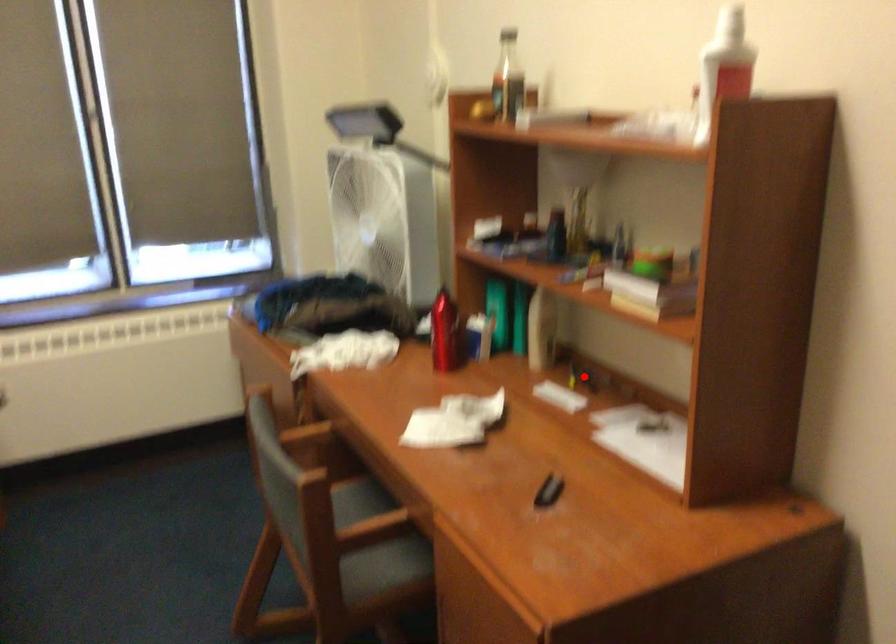
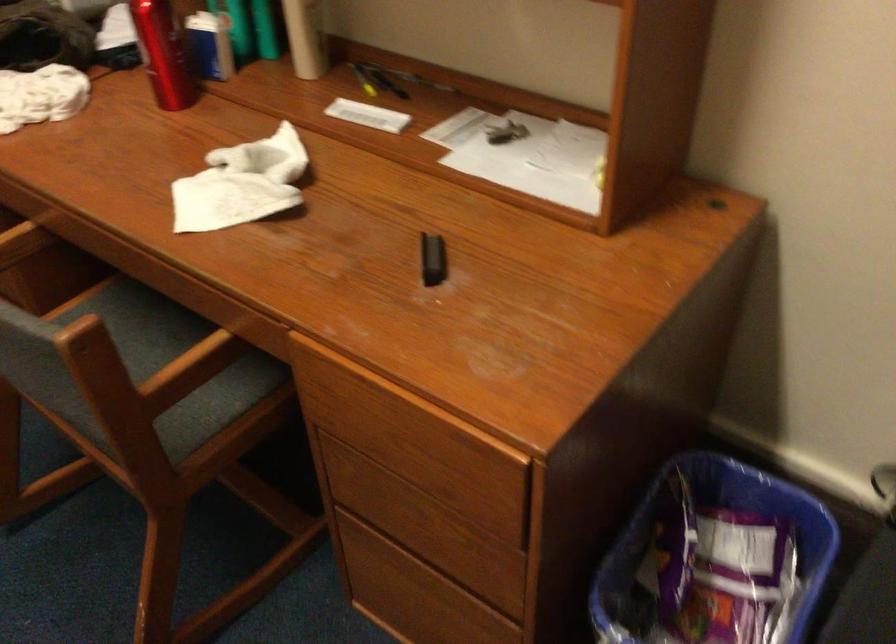
Where in the second image is the point corresponding to the highlighted location from the first image?

(376, 80)